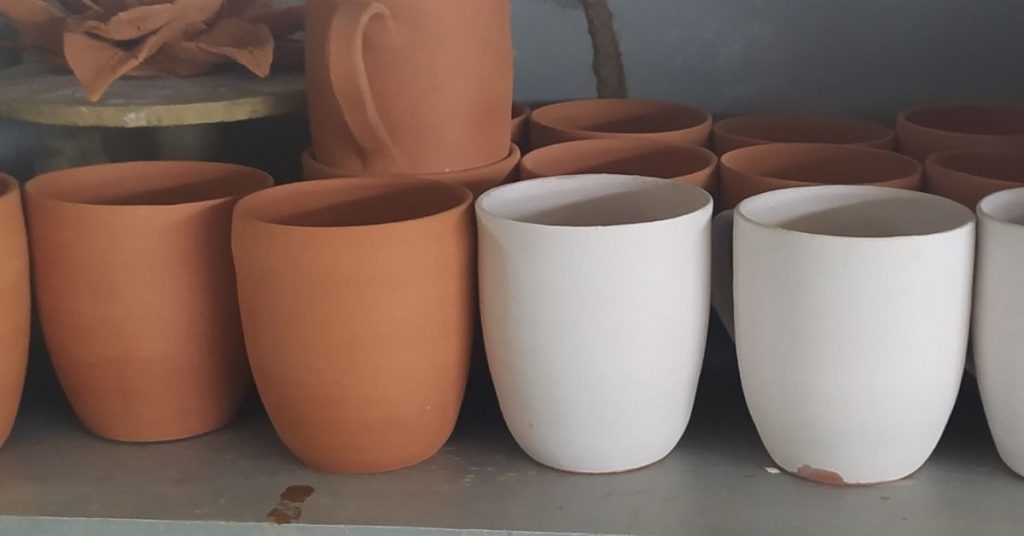
The width and height of the screenshot is (1024, 536). Find the location of `handle`. handle is located at coordinates (356, 111).